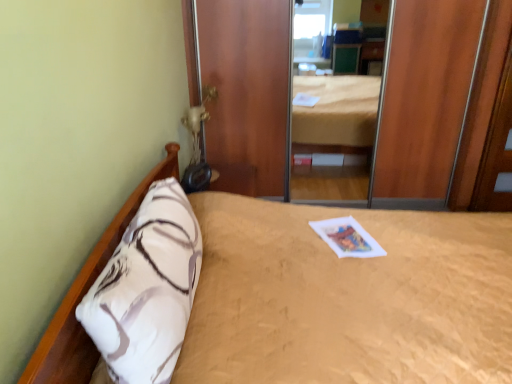
Question: From a real-world perspective, is white soft pillow at left on top of beige textured bed at center?

Choices:
 (A) no
 (B) yes

Answer: (B)

Question: Are white soft pillow at left and beige textured bed at center beside each other?

Choices:
 (A) no
 (B) yes

Answer: (A)

Question: Does white soft pillow at left come behind beige textured bed at center?

Choices:
 (A) yes
 (B) no

Answer: (A)

Question: Would you say white soft pillow at left is outside beige textured bed at center?

Choices:
 (A) no
 (B) yes

Answer: (A)

Question: Is white soft pillow at left thinner than beige textured bed at center?

Choices:
 (A) yes
 (B) no

Answer: (A)

Question: Can you confirm if white soft pillow at left is shorter than beige textured bed at center?

Choices:
 (A) no
 (B) yes

Answer: (B)

Question: Is white paper magazine at center to the right of wooden door at right from the viewer's perspective?

Choices:
 (A) yes
 (B) no

Answer: (B)

Question: From the image's perspective, is white paper magazine at center under wooden door at right?

Choices:
 (A) yes
 (B) no

Answer: (A)

Question: Is the depth of white paper magazine at center greater than that of wooden door at right?

Choices:
 (A) no
 (B) yes

Answer: (A)

Question: From a real-world perspective, is white paper magazine at center under wooden door at right?

Choices:
 (A) no
 (B) yes

Answer: (B)

Question: Considering the relative sizes of white paper magazine at center and wooden door at right in the image provided, is white paper magazine at center shorter than wooden door at right?

Choices:
 (A) no
 (B) yes

Answer: (B)

Question: Is white paper magazine at center closer to camera compared to wooden door at right?

Choices:
 (A) no
 (B) yes

Answer: (B)

Question: Can you confirm if wooden door at right is shorter than white soft pillow at left?

Choices:
 (A) yes
 (B) no

Answer: (B)